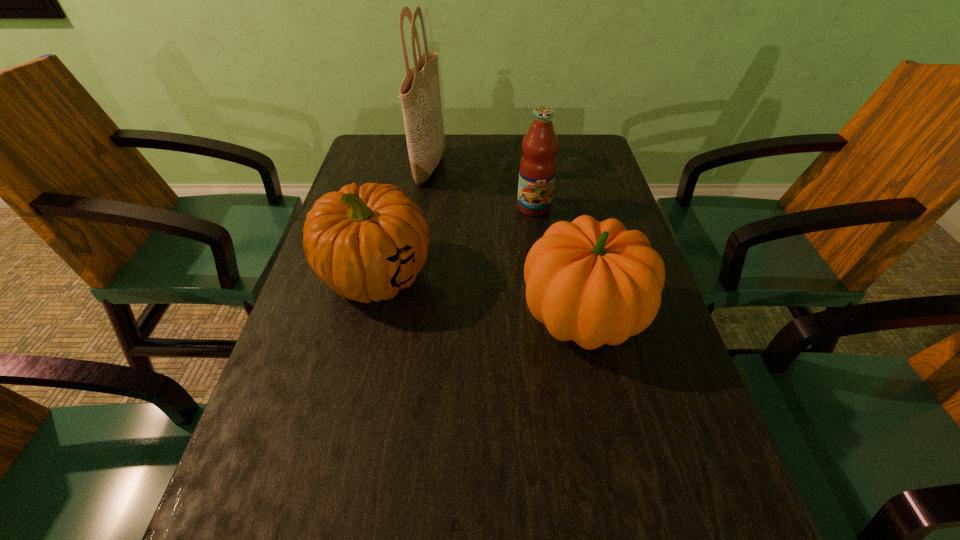
The height and width of the screenshot is (540, 960). In order to click on the farthest object in this screenshot , I will do `click(420, 97)`.

The image size is (960, 540). I want to click on the tallest object, so click(420, 97).

Identify the location of fruit juice. (537, 171).

In order to click on the left pumpkin in this screenshot , I will do `click(367, 243)`.

Image resolution: width=960 pixels, height=540 pixels. Find the location of `the right pumpkin`. the right pumpkin is located at coordinates pyautogui.click(x=596, y=283).

This screenshot has height=540, width=960. In order to click on vacant region located on the right of the farthest object in this screenshot , I will do `click(549, 167)`.

Locate an element on the screen. vacant space located 0.390m on the front label of the fruit juice is located at coordinates (553, 340).

Locate an element on the screen. Image resolution: width=960 pixels, height=540 pixels. vacant space located 0.160m on the surface of the left pumpkin is located at coordinates (348, 391).

Locate an element on the screen. vacant space located 0.390m on the left of the right pumpkin is located at coordinates pos(330,318).

You are a GUI agent. You are given a task and a screenshot of the screen. Output one action in this format:
    pyautogui.click(x=<x>, y=<y>)
    Task: Click on the object located at the far edge
    This screenshot has height=540, width=960.
    Given the screenshot: What is the action you would take?
    pyautogui.click(x=420, y=97)